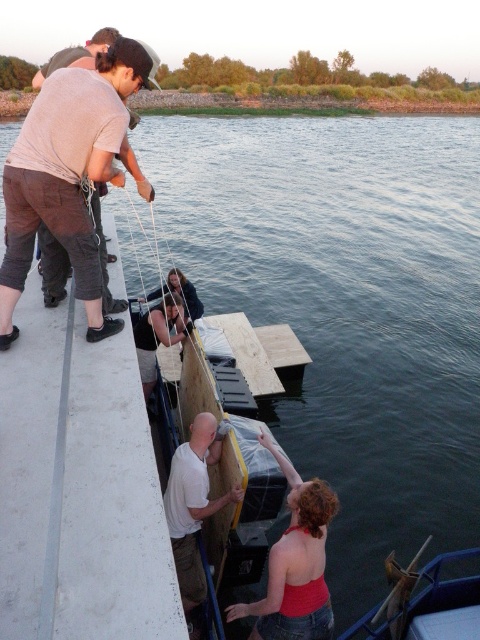
Question: Is matte gray shirt at left positioned behind white matte shirt at lower center?

Choices:
 (A) yes
 (B) no

Answer: (A)

Question: Which point is closer to the camera?

Choices:
 (A) (60, 147)
 (B) (328, 598)
 (C) (424, 612)
 (D) (213, 499)

Answer: (B)

Question: Does matte gray shirt at left have a larger size compared to dark brown leather jacket at center?

Choices:
 (A) no
 (B) yes

Answer: (B)

Question: Which object is closer to the camera taking this photo?

Choices:
 (A) red sleeveless top at lower right
 (B) matte black shirt at center
 (C) matte gray shirt at left
 (D) dark brown leather jacket at center

Answer: (A)

Question: Which of the following is the closest to the observer?

Choices:
 (A) red sleeveless top at lower right
 (B) matte gray shirt at left
 (C) dark brown leather jacket at center
 (D) white matte shirt at lower center

Answer: (A)

Question: Is matte gray shirt at left below wooden boat at lower right?

Choices:
 (A) yes
 (B) no

Answer: (B)